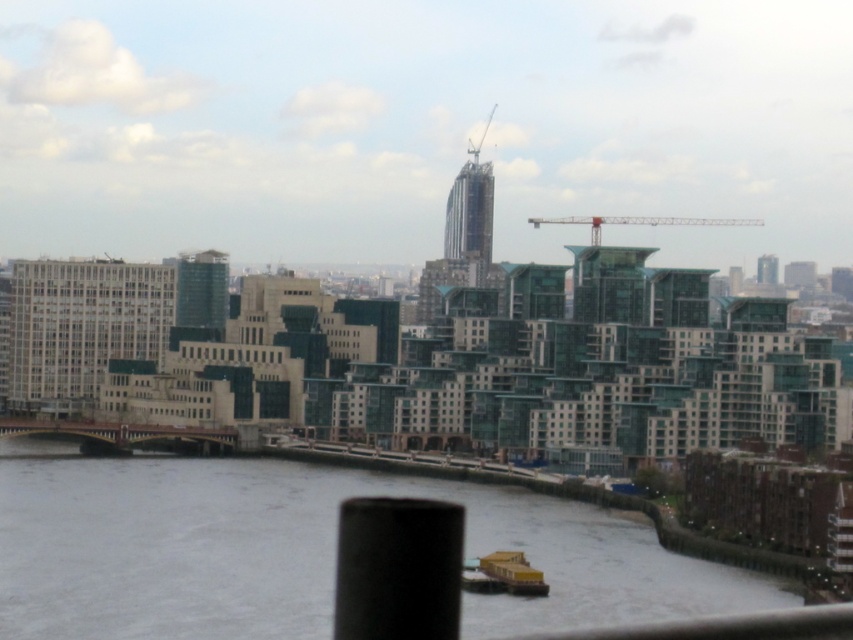
Question: Is metallic red crane at upper center further to camera compared to metallic gray crane at upper center?

Choices:
 (A) no
 (B) yes

Answer: (B)

Question: Does metallic red crane at upper center have a lesser width compared to metallic gray crane at upper center?

Choices:
 (A) no
 (B) yes

Answer: (A)

Question: Which of the following is the farthest from the observer?

Choices:
 (A) metallic red crane at upper center
 (B) gray water at lower center
 (C) metallic gray crane at upper center

Answer: (A)

Question: Does gray water at lower center appear on the right side of metallic red crane at upper center?

Choices:
 (A) no
 (B) yes

Answer: (A)

Question: Which point is farther to the camera?

Choices:
 (A) (488, 120)
 (B) (322, 582)

Answer: (A)

Question: Which point appears closest to the camera in this image?

Choices:
 (A) (608, 216)
 (B) (477, 602)

Answer: (B)